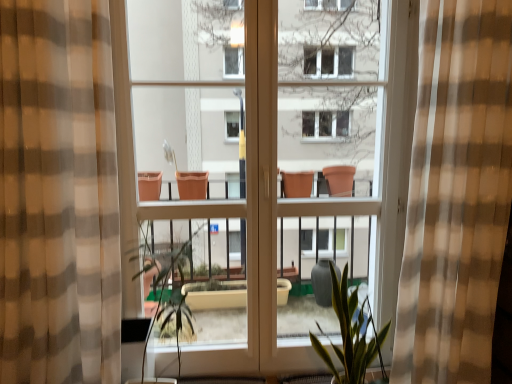
Question: From a real-world perspective, is brown checkered curtain at left, arranged as the second curtain when viewed from the right, on green leafy plant at center?

Choices:
 (A) no
 (B) yes

Answer: (B)

Question: Does brown checkered curtain at left, arranged as the second curtain when viewed from the right, come in front of green leafy plant at center?

Choices:
 (A) no
 (B) yes

Answer: (B)

Question: Can you confirm if brown checkered curtain at left, arranged as the second curtain when viewed from the right, is smaller than green leafy plant at center?

Choices:
 (A) no
 (B) yes

Answer: (A)

Question: Is green leafy plant at center located within brown checkered curtain at left, arranged as the second curtain when viewed from the right?

Choices:
 (A) no
 (B) yes

Answer: (A)

Question: Is brown checkered curtain at left, the 1th curtain when ordered from left to right, at the right side of green leafy plant at center?

Choices:
 (A) yes
 (B) no

Answer: (B)

Question: Does brown checkered curtain at left, arranged as the second curtain when viewed from the right, have a larger size compared to green leafy plant at center?

Choices:
 (A) no
 (B) yes

Answer: (B)

Question: From the image's perspective, does green leafy plant at center appear lower than green matte plant at center?

Choices:
 (A) no
 (B) yes

Answer: (A)

Question: Is green leafy plant at center shorter than green matte plant at center?

Choices:
 (A) no
 (B) yes

Answer: (A)

Question: From a real-world perspective, does green leafy plant at center stand above green matte plant at center?

Choices:
 (A) yes
 (B) no

Answer: (A)

Question: Does green leafy plant at center contain green matte plant at center?

Choices:
 (A) yes
 (B) no

Answer: (B)

Question: Is the position of green leafy plant at center more distant than that of green matte plant at center?

Choices:
 (A) no
 (B) yes

Answer: (A)

Question: From a real-world perspective, is green leafy plant at center below green matte plant at center?

Choices:
 (A) no
 (B) yes

Answer: (A)

Question: From the image's perspective, is green leafy plant at center located above checkered fabric curtain at center, which is the 2th curtain from left to right?

Choices:
 (A) no
 (B) yes

Answer: (A)